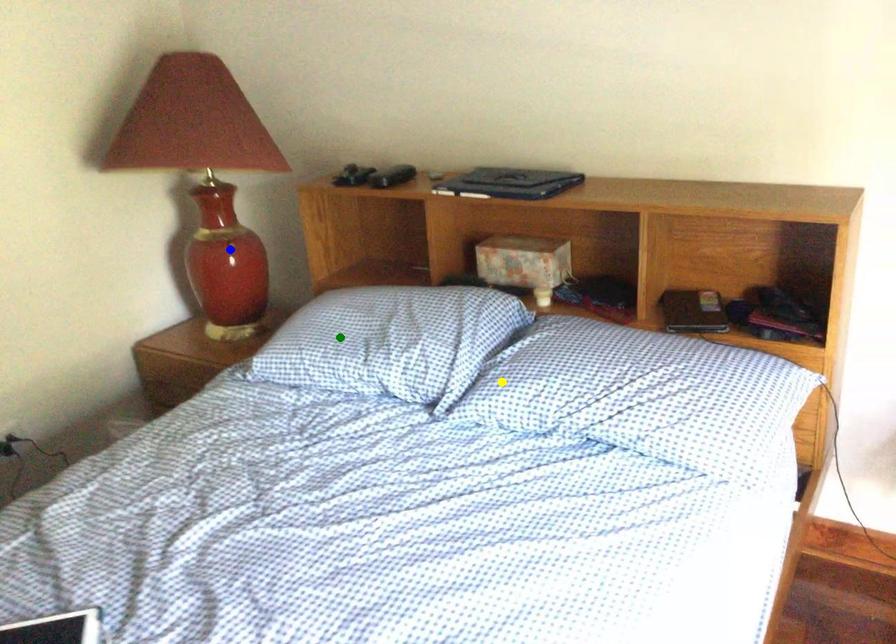
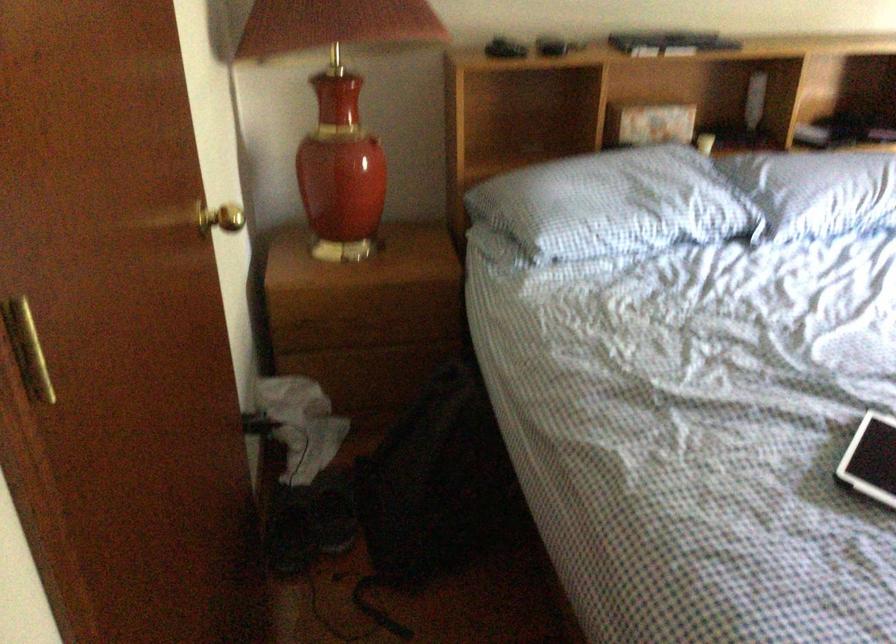
I am providing you with two images of the same scene from different viewpoints. Three points are marked in image1. Which point corresponds to a part or object that is occluded in image2?In image1, three points are marked. Which of them correspond to a part or object that is occluded in image2?Among the three points shown in image1, which one corresponds to a part or object that is no longer visible due to occlusion in image2?

Invisible in image2: blue point.